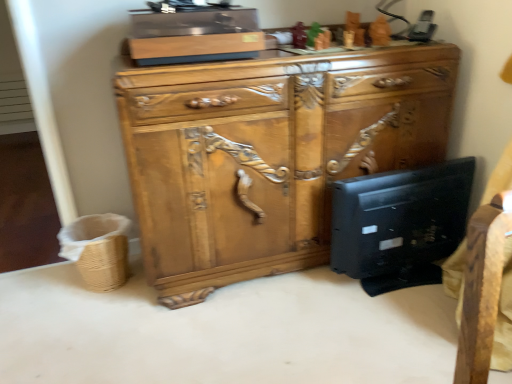
The height and width of the screenshot is (384, 512). What are the coordinates of `free space between black matte desktop computer at lower right and wooden carved cabinet at center` in the screenshot? It's located at (273, 296).